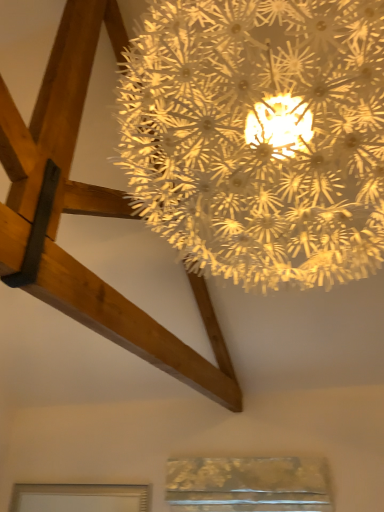
Question: From the image's perspective, is matte silver frame at lower left, acting as the 2th window starting from the right, located beneath illuminated paper-like at upper center?

Choices:
 (A) no
 (B) yes

Answer: (B)

Question: Does matte silver frame at lower left, the first window in the left-to-right sequence, have a smaller size compared to illuminated paper-like at upper center?

Choices:
 (A) no
 (B) yes

Answer: (B)

Question: Is matte silver frame at lower left, the first window in the left-to-right sequence, positioned with its back to illuminated paper-like at upper center?

Choices:
 (A) no
 (B) yes

Answer: (A)

Question: Is matte silver frame at lower left, the first window in the left-to-right sequence, far from illuminated paper-like at upper center?

Choices:
 (A) no
 (B) yes

Answer: (B)

Question: Does matte silver frame at lower left, the first window in the left-to-right sequence, have a greater width compared to illuminated paper-like at upper center?

Choices:
 (A) no
 (B) yes

Answer: (A)

Question: From a real-world perspective, is illuminated paper-like at upper center above or below matte silver frame at lower left, acting as the 2th window starting from the right?

Choices:
 (A) above
 (B) below

Answer: (A)

Question: Is point (x=369, y=254) closer or farther from the camera than point (x=56, y=500)?

Choices:
 (A) closer
 (B) farther

Answer: (A)

Question: From the image's perspective, relative to matte silver frame at lower left, the first window in the left-to-right sequence, is illuminated paper-like at upper center above or below?

Choices:
 (A) above
 (B) below

Answer: (A)

Question: Would you say illuminated paper-like at upper center is inside or outside matte silver frame at lower left, the first window in the left-to-right sequence?

Choices:
 (A) inside
 (B) outside

Answer: (B)

Question: Is metallic gold window at lower center, acting as the second window starting from the left, spatially inside illuminated paper-like at upper center, or outside of it?

Choices:
 (A) inside
 (B) outside

Answer: (B)

Question: Is metallic gold window at lower center, acting as the second window starting from the left, wider or thinner than illuminated paper-like at upper center?

Choices:
 (A) thin
 (B) wide

Answer: (A)

Question: From the image's perspective, is metallic gold window at lower center, placed as the 1th window when sorted from right to left, located above or below illuminated paper-like at upper center?

Choices:
 (A) above
 (B) below

Answer: (B)

Question: In the image, is metallic gold window at lower center, placed as the 1th window when sorted from right to left, positioned in front of or behind illuminated paper-like at upper center?

Choices:
 (A) behind
 (B) front

Answer: (A)

Question: Is matte silver frame at lower left, acting as the 2th window starting from the right, inside the boundaries of illuminated paper-like at upper center, or outside?

Choices:
 (A) inside
 (B) outside

Answer: (B)

Question: Based on their positions, is matte silver frame at lower left, acting as the 2th window starting from the right, located to the left or right of illuminated paper-like at upper center?

Choices:
 (A) left
 (B) right

Answer: (A)